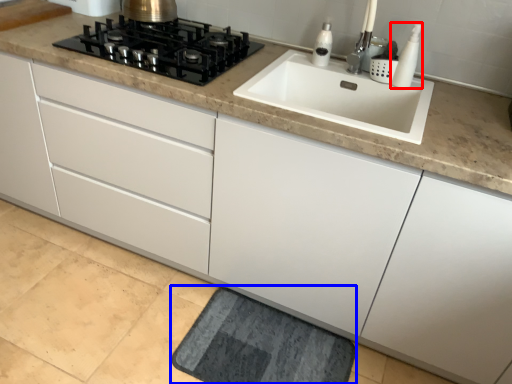
Question: Among these objects, which one is nearest to the camera, soap dispenser (highlighted by a red box) or bath mat (highlighted by a blue box)?

Choices:
 (A) soap dispenser
 (B) bath mat

Answer: (B)